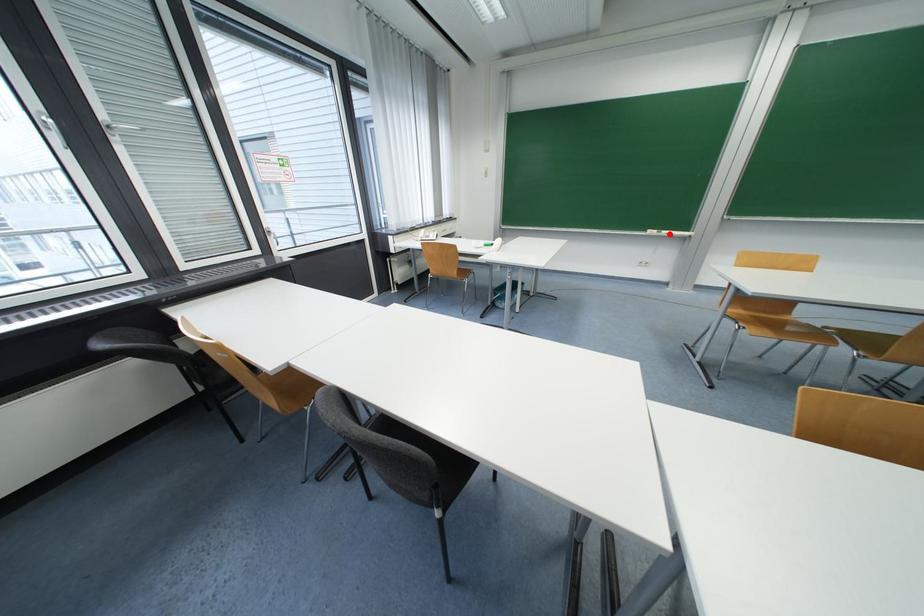
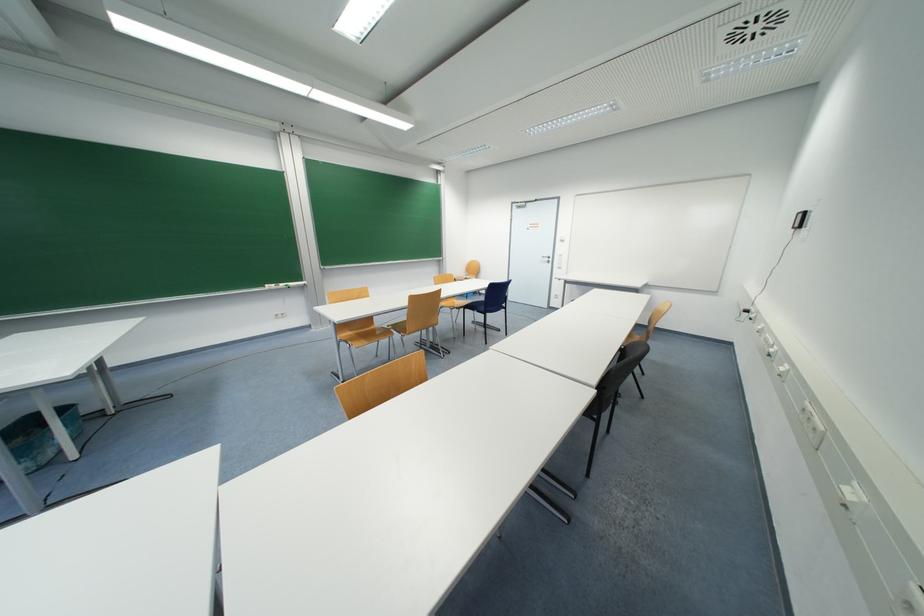
Locate, in the second image, the point that corresponds to the highlighted location in the first image.

(286, 286)